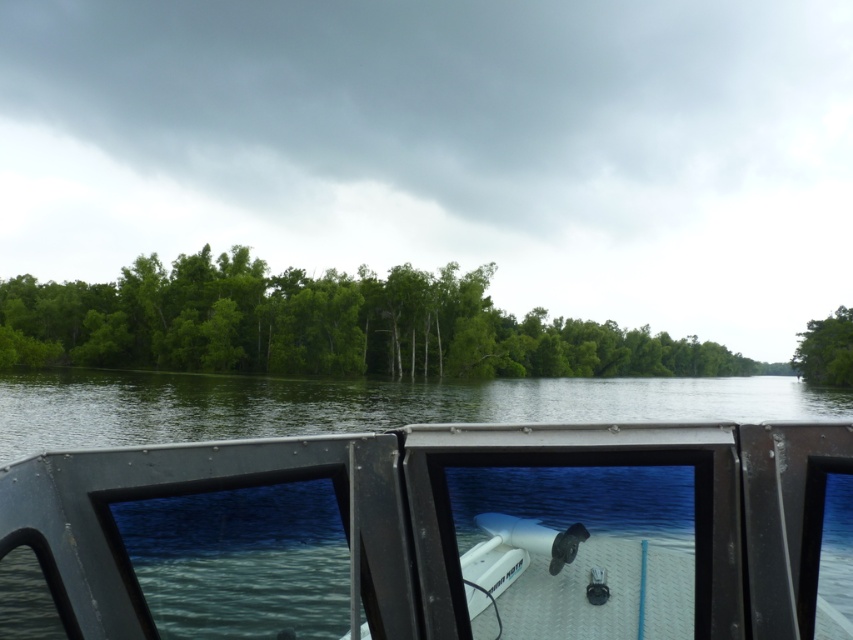
You are standing on the edge of the boat and want to take a photo of the green leafy tree at right without the white matte boat at center blocking the view. Is this possible?

The white matte boat at center is positioned over the green leafy tree at right, so taking a photo without the boat blocking the view would not be possible as the boat is directly in front of the tree from your current position.

You are on a boat and want to know if the white matte boat at center is between you and the green leafy trees at center. Based on the scene, is this true?

Yes, the white matte boat at center is closer to the viewer than the green leafy trees at center, so it is between you and the green leafy trees at center.

You are navigating a small boat on a calm lake. Your destination is directly ahead of you, but there is an obstacle in the water. You need to steer around it. Which direction should you turn to avoid the obstacle while staying on course? The obstacle is the white matte boat at center.

The white matte boat at center is located at point coordinates (434, 534). Since it is directly ahead, you should turn either left or right to avoid it while maintaining your course.